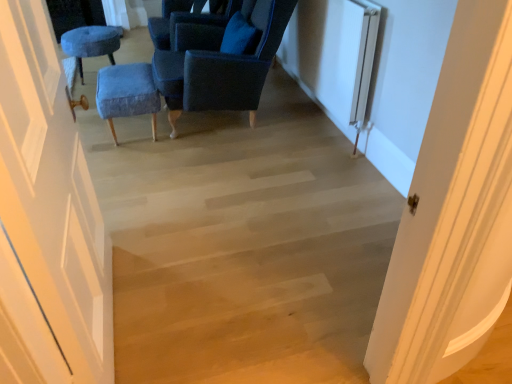
I want to click on free space on the front side of velvet blue chair at center, placed as the second chair when sorted from back to front, so click(217, 180).